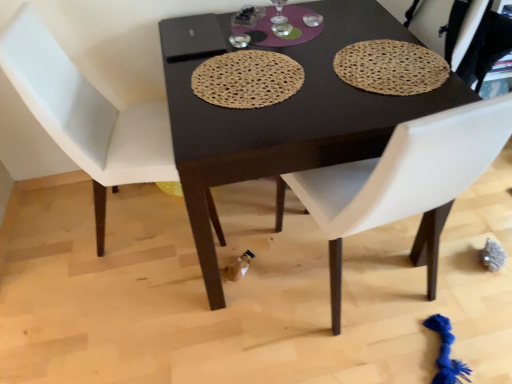
Locate an element on the screen. The height and width of the screenshot is (384, 512). vacant space behind brown woven placemat at upper right, the second mat viewed from the left is located at coordinates (350, 22).